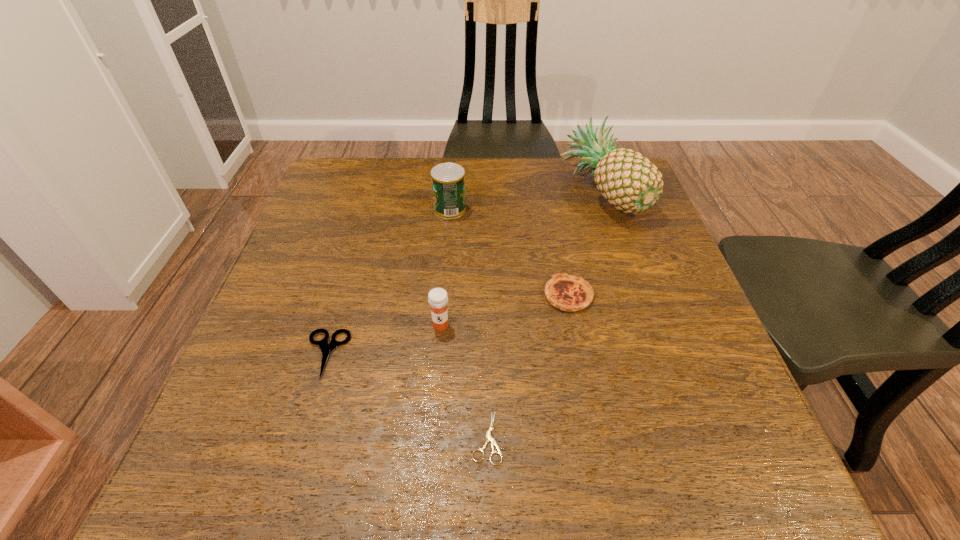
The height and width of the screenshot is (540, 960). In order to click on vacant region between the second tallest object and the farther shears in this screenshot , I will do (x=388, y=282).

Identify the location of free space between the taller shears and the fourth object from left to right. This screenshot has width=960, height=540. (406, 396).

Locate an element on the screen. Image resolution: width=960 pixels, height=540 pixels. vacant area between the medicine and the right shears is located at coordinates tap(464, 381).

I want to click on vacant point located between the tallest object and the shorter shears, so click(543, 315).

Identify the location of free space between the medicine and the nearest object. (464, 381).

This screenshot has width=960, height=540. I want to click on free space between the medicine and the right shears, so click(x=464, y=381).

Where is `object identified as the closest to the tallest object`? This screenshot has width=960, height=540. object identified as the closest to the tallest object is located at coordinates (569, 293).

Find the location of a particular element. This screenshot has width=960, height=540. the fifth closest object to the fourth nearest object is located at coordinates (326, 348).

Where is `vacant space that satisfies the following two spatial constraints: 1. on the label side of the shortest object; 2. on the right side of the medicine`? The width and height of the screenshot is (960, 540). vacant space that satisfies the following two spatial constraints: 1. on the label side of the shortest object; 2. on the right side of the medicine is located at coordinates click(x=432, y=437).

Locate an element on the screen. The image size is (960, 540). blank space that satisfies the following two spatial constraints: 1. on the back side of the third farthest object; 2. on the left side of the tallest object is located at coordinates (548, 192).